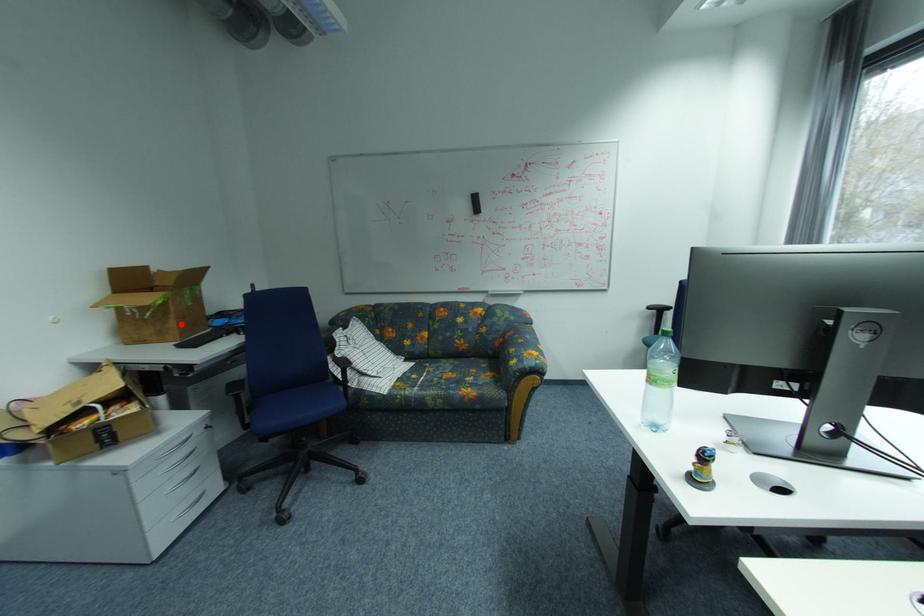
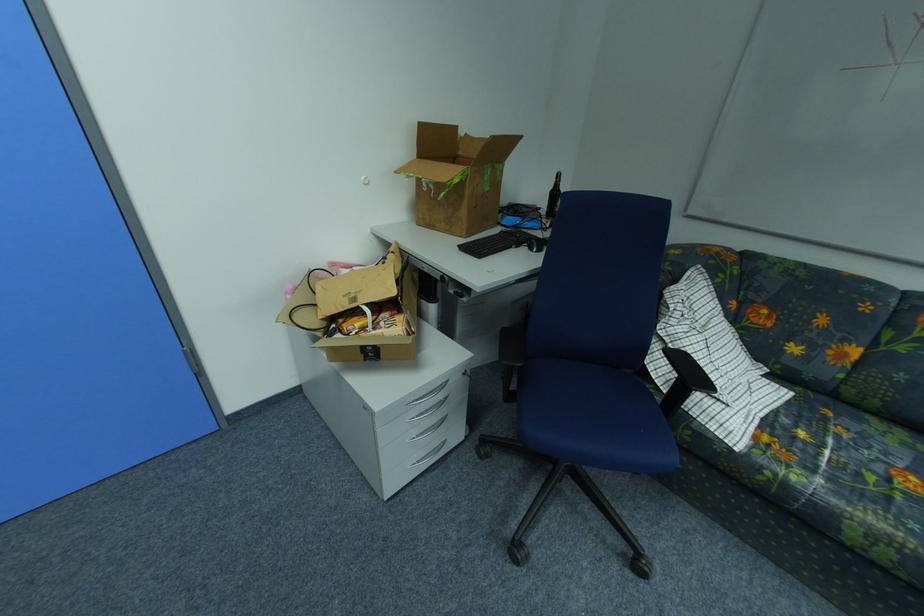
Find the pixel in the second image that matches the highlighted location in the first image.

(470, 214)